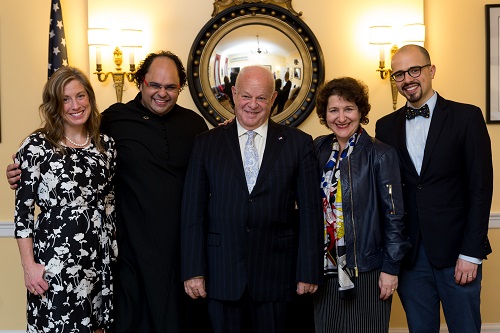
The image size is (500, 333). Identify the location of light fixture. (117, 76), (393, 91).